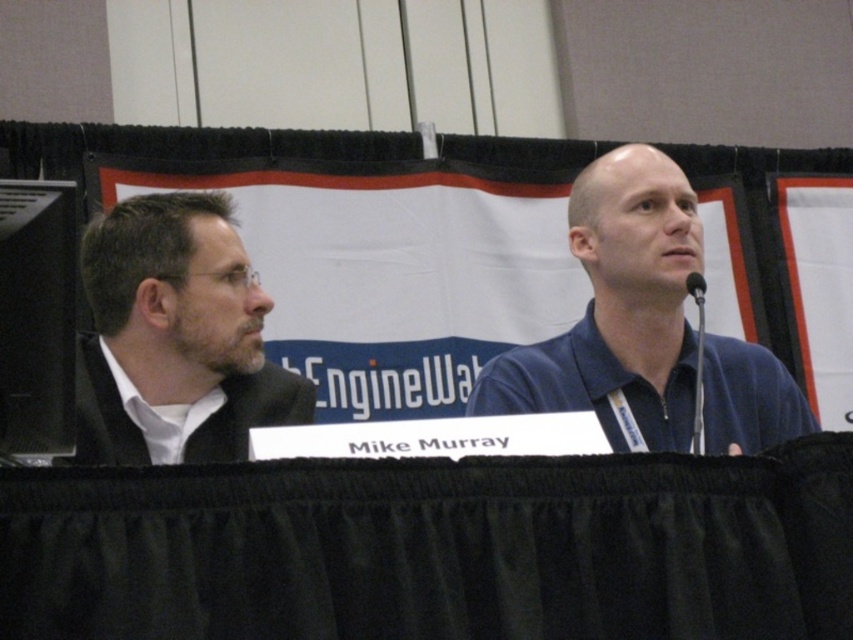
Question: Which of these objects is positioned closest to the black plastic microphone at upper right?

Choices:
 (A) blue zip-up shirt at center
 (B) matte black jacket at left

Answer: (A)

Question: Which point is farther to the camera?

Choices:
 (A) black plastic microphone at upper right
 (B) blue zip-up shirt at center

Answer: (B)

Question: Can you confirm if blue zip-up shirt at center is positioned above black plastic microphone at upper right?

Choices:
 (A) yes
 (B) no

Answer: (B)

Question: Does matte black jacket at left appear over black plastic microphone at upper right?

Choices:
 (A) no
 (B) yes

Answer: (A)

Question: Estimate the real-world distances between objects in this image. Which object is closer to the blue zip-up shirt at center?

Choices:
 (A) matte black jacket at left
 (B) black plastic microphone at upper right

Answer: (B)

Question: Is blue zip-up shirt at center smaller than black plastic microphone at upper right?

Choices:
 (A) yes
 (B) no

Answer: (B)